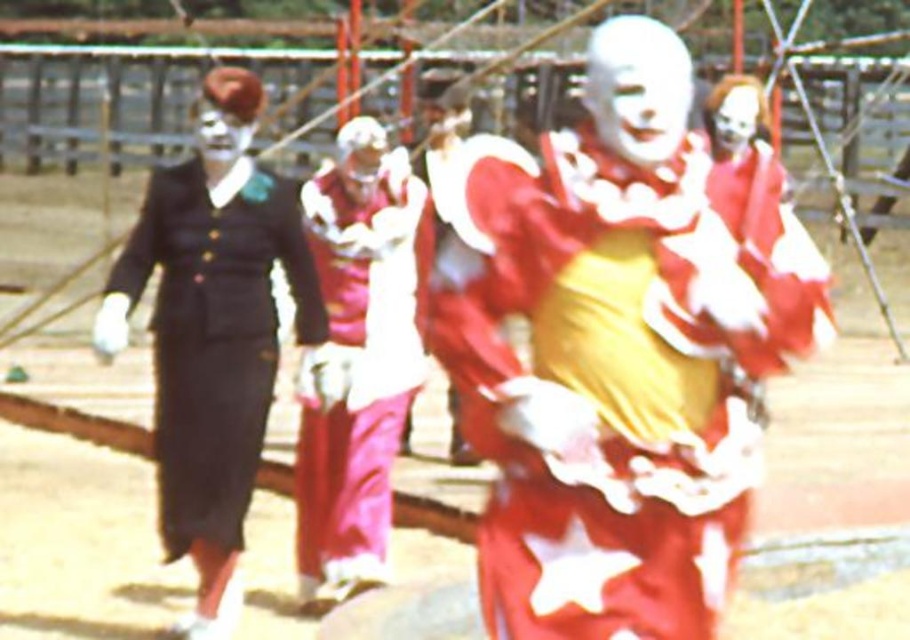
Does point (167, 436) lie in front of point (332, 564)?

Yes, it is in front of point (332, 564).

Can you confirm if matte black suit at left is positioned below shiny red clown costume at center?

No, matte black suit at left is not below shiny red clown costume at center.

Who is more distant from viewer, (248, 502) or (360, 324)?

The point (360, 324) is behind.

Identify the location of matte black suit at left. This screenshot has height=640, width=910. (214, 339).

Between shiny red fabric clown at center and white matte mask at center, which one is positioned higher?

white matte mask at center

From the picture: Can you confirm if shiny red fabric clown at center is thinner than white matte mask at center?

No, shiny red fabric clown at center is not thinner than white matte mask at center.

The height and width of the screenshot is (640, 910). Find the location of `shiny red fabric clown at center`. shiny red fabric clown at center is located at coordinates (607, 385).

Looking at this image, can you confirm if matte black suit at left is wider than white matte face at upper center?

Yes, matte black suit at left is wider than white matte face at upper center.

Is matte black suit at left above white matte face at upper center?

No.

Measure the distance between matte black suit at left and camera.

matte black suit at left and camera are 7.61 meters apart.

The width and height of the screenshot is (910, 640). I want to click on matte black suit at left, so click(x=214, y=339).